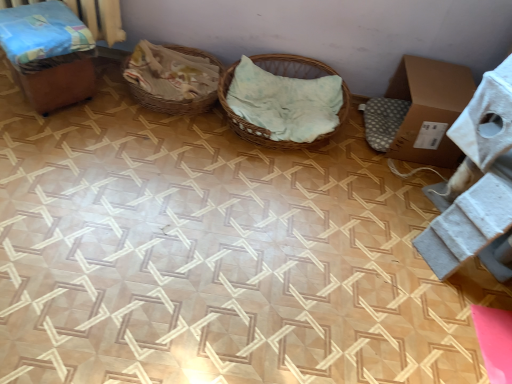
This screenshot has width=512, height=384. I want to click on vacant area that is in front of woven brown basket at center, positioned as the second basket in right-to-left order, so click(152, 142).